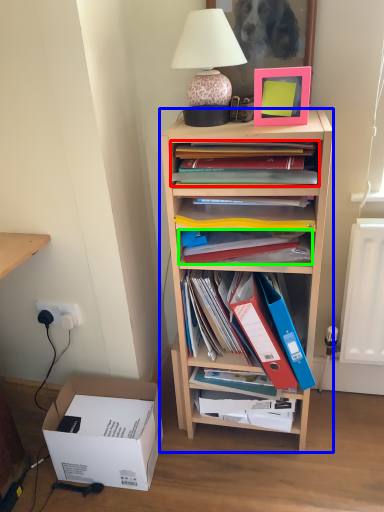
Question: Which object is positioned farthest from book (highlighted by a red box)? Select from shelf (highlighted by a blue box) and magazine (highlighted by a green box).

Choices:
 (A) shelf
 (B) magazine

Answer: (A)